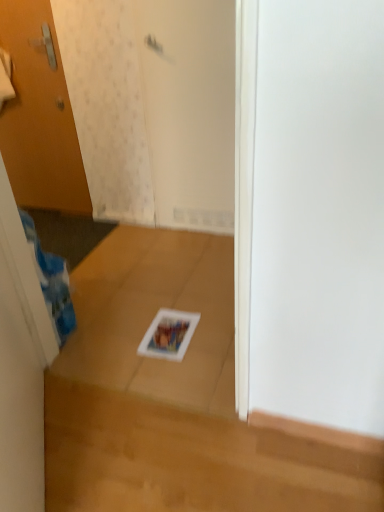
Where is `vacant space to the left of white matte screen door at upper center`? The image size is (384, 512). vacant space to the left of white matte screen door at upper center is located at coordinates (144, 241).